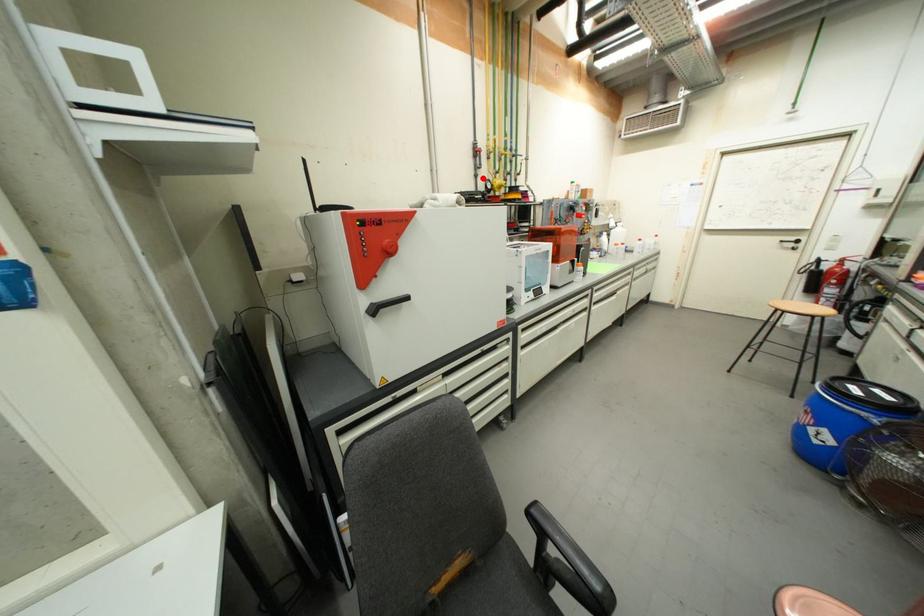
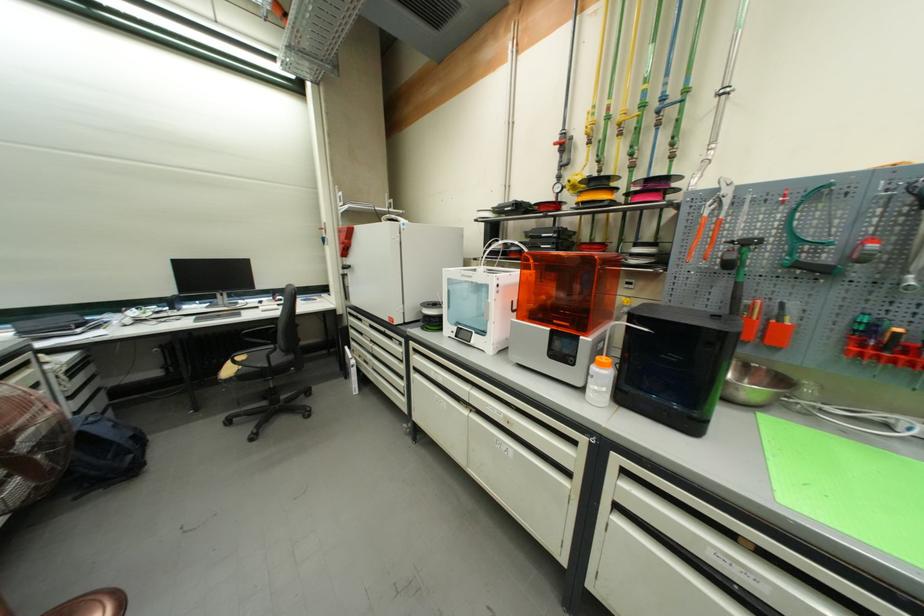
Where in the second image is the point corresponding to the highlighted location from the first image?

(566, 179)